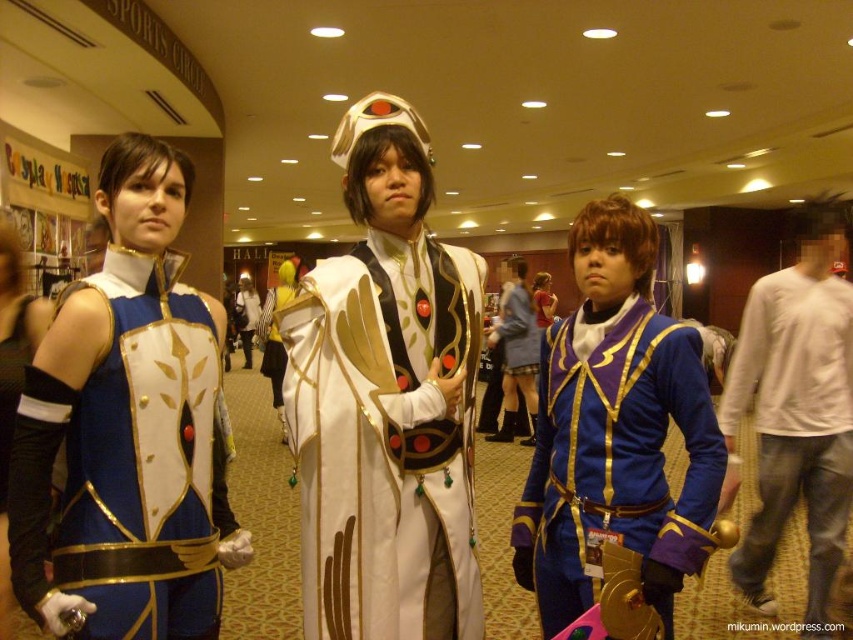
You are a photographer at the convention center. You need to position the white satin robe at center and the matte blue fabric vest at left in a photo. Which object should you place higher in the frame to maintain their actual height relationship?

To maintain their actual height relationship, you should place the white satin robe at center higher in the frame than the matte blue fabric vest at left since it is taller.

You are a photographer at the convention and need to capture a clear photo of both the white satin robe at center and the matte white dress at center. Which one should you focus on first to ensure proper depth of field?

The white satin robe at center is below the matte white dress at center, so you should focus on the white satin robe at center first to ensure proper depth of field.

You are a photographer at the event and need to capture a photo of the white cotton shirt at center and the white satin cape at center. The camera you are using has a maximum focus range of 4 meters. Can you take a photo that includes both objects in focus without moving the camera?

The white cotton shirt at center and the white satin cape at center are 4.91 meters apart. Since the camera has a maximum focus range of 4 meters, it cannot capture both objects in focus without moving the camera because the distance exceeds the camera limit.